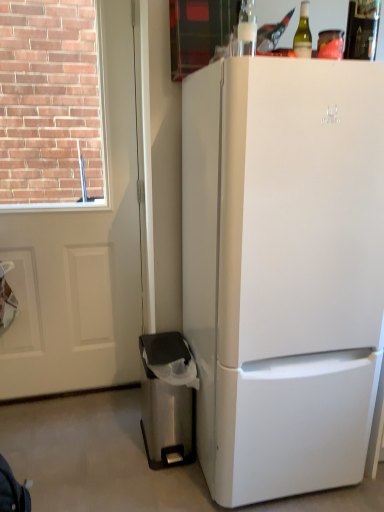
The width and height of the screenshot is (384, 512). I want to click on vacant area on top of stainless steel trash can at lower left (from a real-world perspective), so click(x=172, y=344).